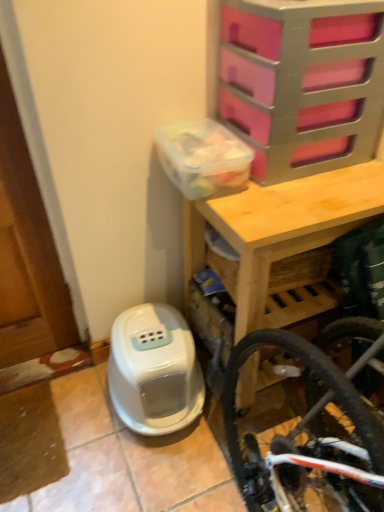
You are a GUI agent. You are given a task and a screenshot of the screen. Output one action in this format:
    pyautogui.click(x=<x>, y=<y>)
    Task: Click on the vacant space in front of white plastic water heater at lower left
    
    Given the screenshot: What is the action you would take?
    pyautogui.click(x=144, y=474)